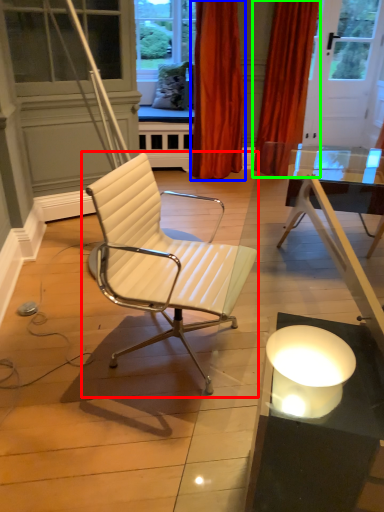
Question: Which object is the farthest from chair (highlighted by a red box)? Choose among these: curtain (highlighted by a blue box) or curtain (highlighted by a green box).

Choices:
 (A) curtain
 (B) curtain

Answer: (B)